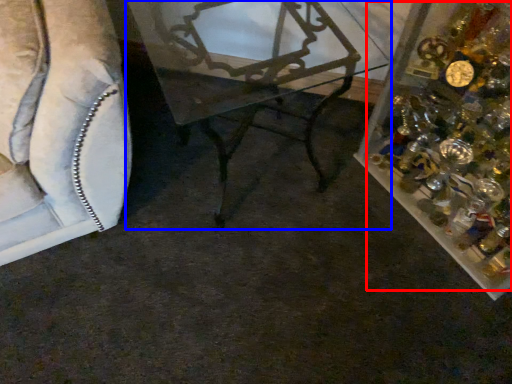
Question: Which of the following is the closest to the observer, christmas decoration (highlighted by a red box) or table (highlighted by a blue box)?

Choices:
 (A) christmas decoration
 (B) table

Answer: (A)